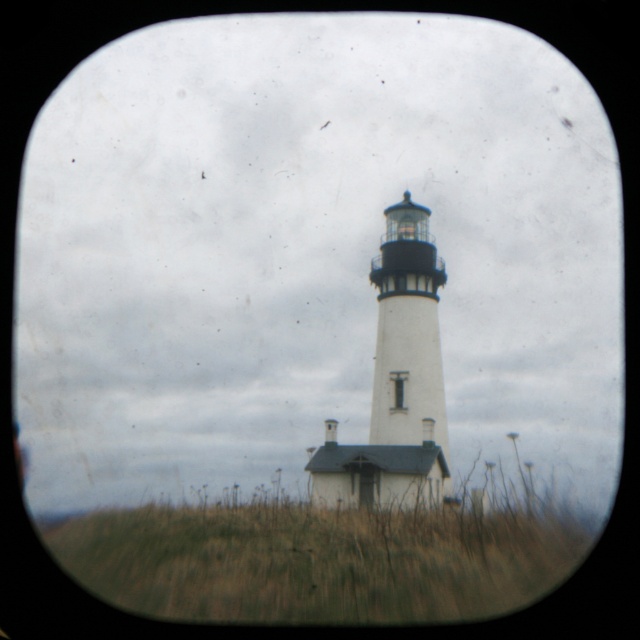
Question: Estimate the real-world distances between objects in this image. Which object is closer to the transparent glass window at center?

Choices:
 (A) brown dry grass at lower center
 (B) white matte/lightweight tower at center

Answer: (B)

Question: Which object is farther from the camera taking this photo?

Choices:
 (A) transparent glass window at center
 (B) white matte/lightweight tower at center

Answer: (A)

Question: Is white matte/lightweight tower at center thinner than transparent glass window at center?

Choices:
 (A) no
 (B) yes

Answer: (A)

Question: Can you confirm if white matte/lightweight tower at center is positioned to the left of transparent glass window at center?

Choices:
 (A) no
 (B) yes

Answer: (A)

Question: Does brown dry grass at lower center have a greater width compared to transparent glass window at center?

Choices:
 (A) no
 (B) yes

Answer: (B)

Question: Which of the following is the farthest from the observer?

Choices:
 (A) brown dry grass at lower center
 (B) white matte/lightweight tower at center

Answer: (A)